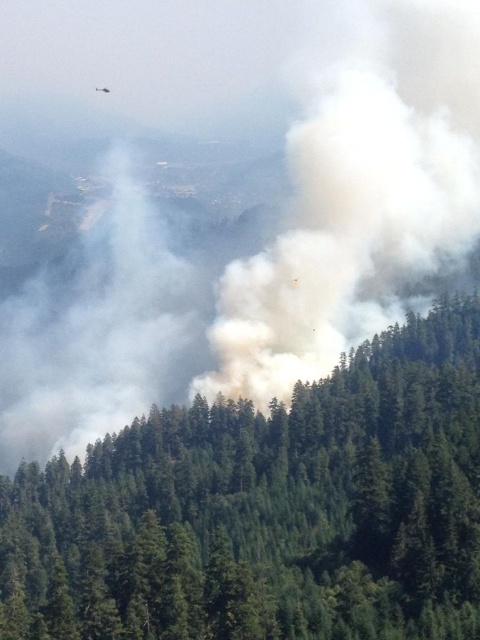
Question: Is green textured trees at center bigger than white fluffy smoke at center?

Choices:
 (A) no
 (B) yes

Answer: (A)

Question: Where is green textured trees at center located in relation to white fluffy smoke at center in the image?

Choices:
 (A) below
 (B) above

Answer: (A)

Question: Is green textured trees at center to the left of white fluffy smoke at center from the viewer's perspective?

Choices:
 (A) no
 (B) yes

Answer: (B)

Question: Which point is closer to the camera?

Choices:
 (A) green textured trees at center
 (B) white fluffy smoke at center

Answer: (A)

Question: Which object appears farthest from the camera in this image?

Choices:
 (A) green textured trees at center
 (B) white fluffy smoke at center

Answer: (B)

Question: Among these points, which one is nearest to the camera?

Choices:
 (A) (298, 122)
 (B) (314, 632)

Answer: (B)